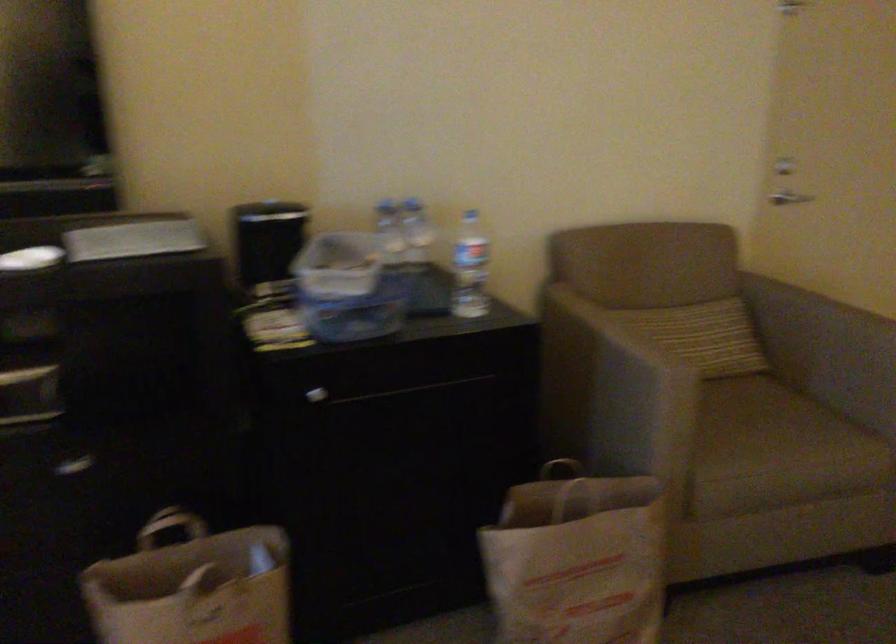
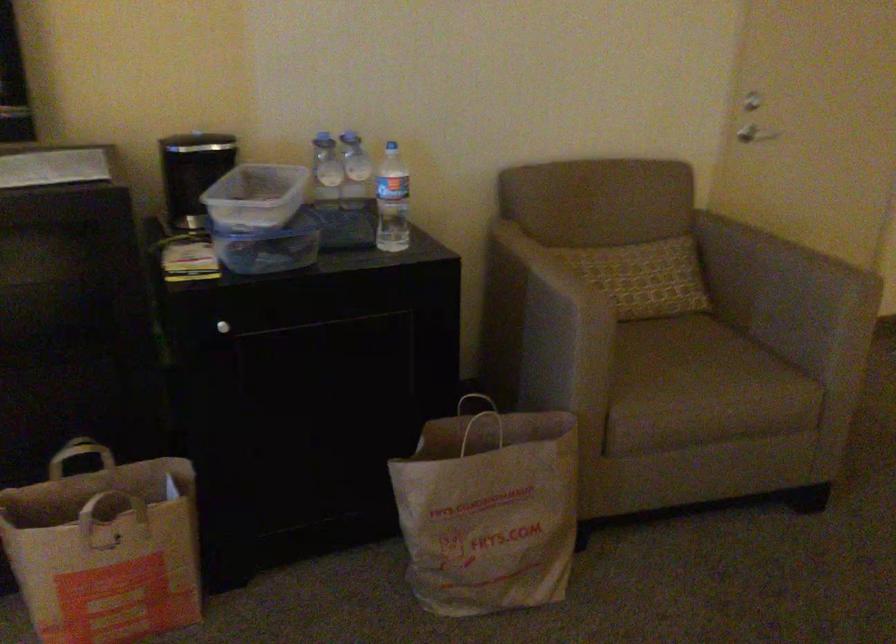
Question: In a continuous first-person perspective shot, in which direction is the camera moving?

Choices:
 (A) Left
 (B) Right
 (C) Forward
 (D) Backward

Answer: (B)